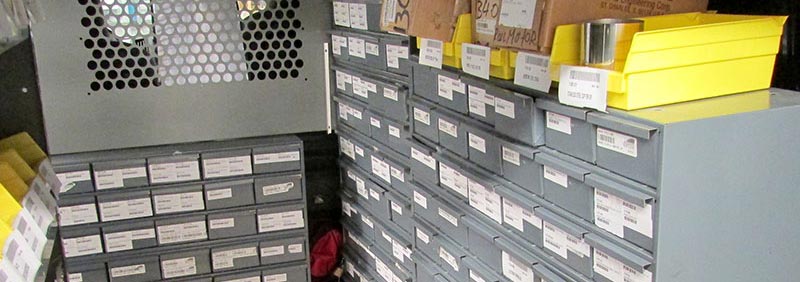
Where is `top of grey cabinet`? This screenshot has height=282, width=800. top of grey cabinet is located at coordinates (686, 113).